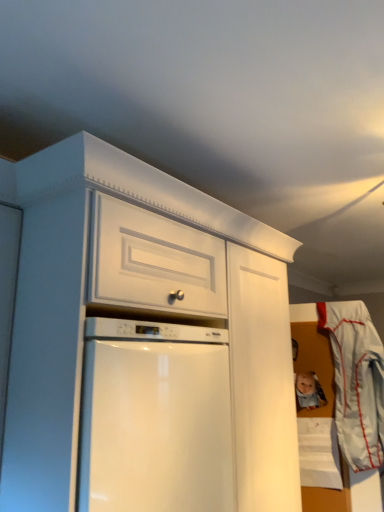
Question: Should I look upward or downward to see white fabric laundry at right?

Choices:
 (A) down
 (B) up

Answer: (A)

Question: Considering the relative sizes of white fabric laundry at right and matte plastic toy at lower right in the image provided, is white fabric laundry at right thinner than matte plastic toy at lower right?

Choices:
 (A) yes
 (B) no

Answer: (B)

Question: Can you confirm if white fabric laundry at right is bigger than matte plastic toy at lower right?

Choices:
 (A) no
 (B) yes

Answer: (B)

Question: From a real-world perspective, is white fabric laundry at right under matte plastic toy at lower right?

Choices:
 (A) yes
 (B) no

Answer: (A)

Question: From the image's perspective, is white fabric laundry at right below matte plastic toy at lower right?

Choices:
 (A) yes
 (B) no

Answer: (A)

Question: Is white fabric laundry at right facing away from matte plastic toy at lower right?

Choices:
 (A) yes
 (B) no

Answer: (B)

Question: From a real-world perspective, is white fabric laundry at right located higher than matte plastic toy at lower right?

Choices:
 (A) yes
 (B) no

Answer: (B)

Question: Is matte plastic toy at lower right shorter than white fabric laundry at right?

Choices:
 (A) no
 (B) yes

Answer: (B)

Question: Does matte plastic toy at lower right have a lesser width compared to white fabric laundry at right?

Choices:
 (A) no
 (B) yes

Answer: (B)

Question: Is matte plastic toy at lower right far from white fabric laundry at right?

Choices:
 (A) no
 (B) yes

Answer: (A)

Question: Does matte plastic toy at lower right come in front of white fabric laundry at right?

Choices:
 (A) no
 (B) yes

Answer: (A)

Question: Does matte plastic toy at lower right appear on the right side of white fabric laundry at right?

Choices:
 (A) no
 (B) yes

Answer: (A)

Question: From the image's perspective, does matte plastic toy at lower right appear higher than white fabric laundry at right?

Choices:
 (A) yes
 (B) no

Answer: (A)

Question: Considering the positions of white fabric laundry at right and matte plastic toy at lower right in the image, is white fabric laundry at right bigger or smaller than matte plastic toy at lower right?

Choices:
 (A) big
 (B) small

Answer: (A)